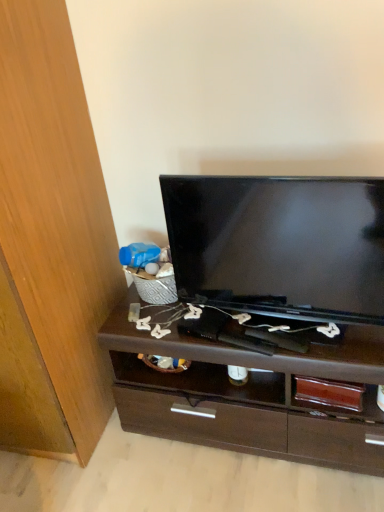
Question: Does black glossy television at center have a greater height compared to dark brown wood chest of drawers at center?

Choices:
 (A) no
 (B) yes

Answer: (A)

Question: Is black glossy television at center not close to dark brown wood chest of drawers at center?

Choices:
 (A) no
 (B) yes

Answer: (A)

Question: Can you confirm if black glossy television at center is smaller than dark brown wood chest of drawers at center?

Choices:
 (A) no
 (B) yes

Answer: (B)

Question: Is black glossy television at center to the left of dark brown wood chest of drawers at center from the viewer's perspective?

Choices:
 (A) yes
 (B) no

Answer: (B)

Question: Is black glossy television at center positioned in front of dark brown wood chest of drawers at center?

Choices:
 (A) yes
 (B) no

Answer: (A)

Question: From a real-world perspective, is wooden cabinet at left above or below dark brown wood chest of drawers at center?

Choices:
 (A) below
 (B) above

Answer: (B)

Question: Is wooden cabinet at left taller or shorter than dark brown wood chest of drawers at center?

Choices:
 (A) short
 (B) tall

Answer: (B)

Question: In terms of width, does wooden cabinet at left look wider or thinner when compared to dark brown wood chest of drawers at center?

Choices:
 (A) thin
 (B) wide

Answer: (B)

Question: Considering their positions, is wooden cabinet at left located in front of or behind dark brown wood chest of drawers at center?

Choices:
 (A) front
 (B) behind

Answer: (A)

Question: Is point (72, 246) closer or farther from the camera than point (284, 269)?

Choices:
 (A) closer
 (B) farther

Answer: (B)

Question: From the image's perspective, relative to black glossy television at center, is wooden cabinet at left above or below?

Choices:
 (A) below
 (B) above

Answer: (B)

Question: In the image, is wooden cabinet at left on the left side or the right side of black glossy television at center?

Choices:
 (A) right
 (B) left

Answer: (B)

Question: Is wooden cabinet at left inside the boundaries of black glossy television at center, or outside?

Choices:
 (A) inside
 (B) outside

Answer: (B)

Question: From a real-world perspective, relative to dark brown wood chest of drawers at center, is black glossy television at center vertically above or below?

Choices:
 (A) above
 (B) below

Answer: (A)

Question: Considering the positions of black glossy television at center and dark brown wood chest of drawers at center in the image, is black glossy television at center taller or shorter than dark brown wood chest of drawers at center?

Choices:
 (A) short
 (B) tall

Answer: (A)